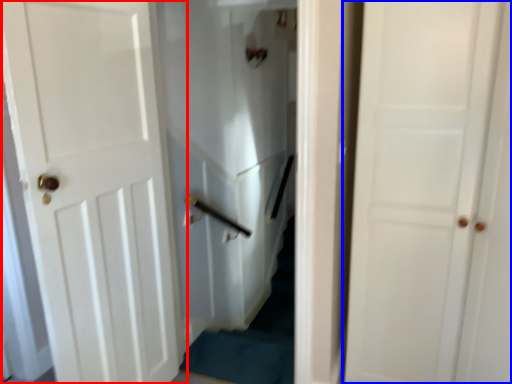
Question: Which object is closer to the camera taking this photo, door (highlighted by a red box) or door (highlighted by a blue box)?

Choices:
 (A) door
 (B) door

Answer: (B)